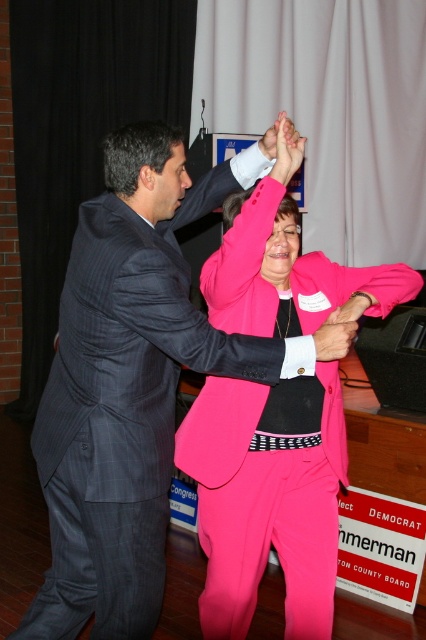
Question: Which point is farther to the camera?

Choices:
 (A) dark gray pinstripe suit at center
 (B) pink fabric hand at upper center

Answer: (B)

Question: Is pink matte suit at center positioned before pink fabric hand at upper center?

Choices:
 (A) no
 (B) yes

Answer: (B)

Question: Which object is closer to the camera taking this photo?

Choices:
 (A) pink fabric hand at upper center
 (B) dark gray pinstripe suit at center

Answer: (B)

Question: Can you confirm if dark gray pinstripe suit at center is thinner than pink matte suit at center?

Choices:
 (A) yes
 (B) no

Answer: (B)

Question: Considering the relative positions of dark gray pinstripe suit at center and pink matte suit at center in the image provided, where is dark gray pinstripe suit at center located with respect to pink matte suit at center?

Choices:
 (A) above
 (B) below

Answer: (A)

Question: Which point appears closest to the camera in this image?

Choices:
 (A) (143, 556)
 (B) (299, 264)
 (C) (265, 150)
 (D) (325, 330)

Answer: (D)